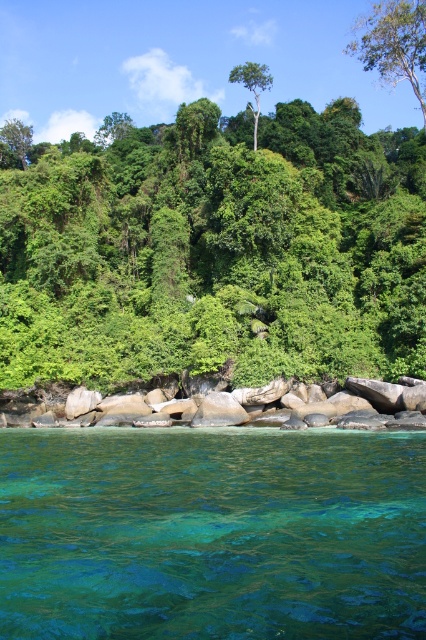
You are a hiker who wants to take a photo of both the green leafy tree at center and the green smooth tree at center. Which tree should you stand closer to in order to capture both in a single frame without zooming?

To capture both the green leafy tree at center and the green smooth tree at center in a single frame without zooming, you should stand closer to the green smooth tree at center. Since the green leafy tree at center is wider, positioning yourself closer to the narrower green smooth tree will help include both within the camera frame more effectively.

You are a bird looking for a nesting spot. You see the green leafy tree at upper center and the green smooth tree at center. Which tree would provide more coverage for nesting?

The green leafy tree at upper center has a larger size compared to the green smooth tree at center, so it would provide more coverage for nesting.